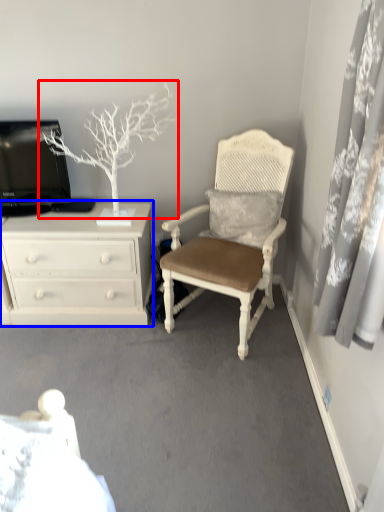
Question: Which point is closer to the camera, tree (highlighted by a red box) or chest of drawers (highlighted by a blue box)?

Choices:
 (A) tree
 (B) chest of drawers

Answer: (A)